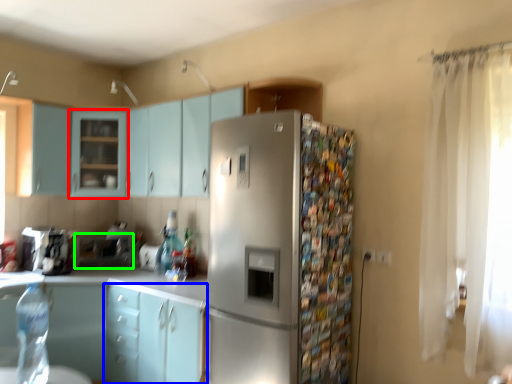
Question: Estimate the real-world distances between objects in this image. Which object is closer to cabinetry (highlighted by a red box), cabinetry (highlighted by a blue box) or appliance (highlighted by a green box)?

Choices:
 (A) cabinetry
 (B) appliance

Answer: (B)